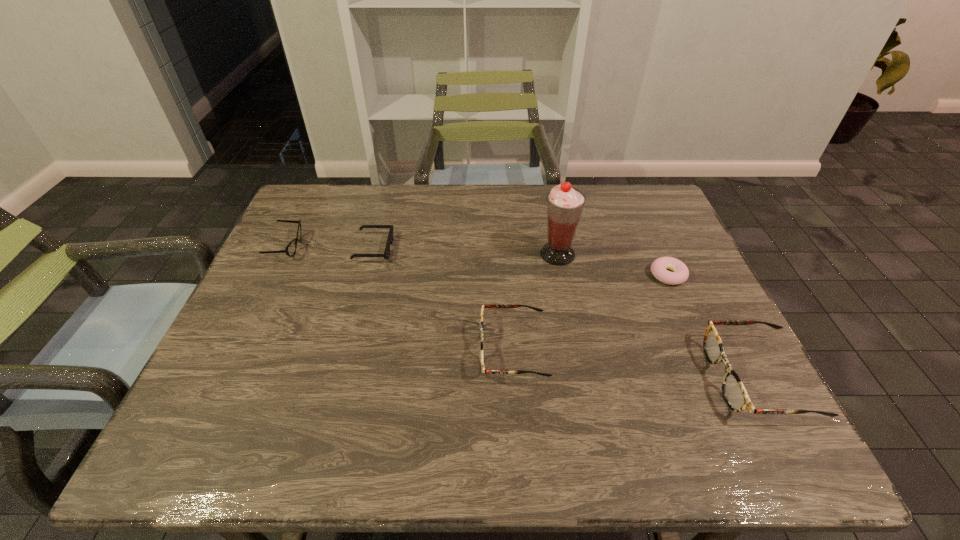
Where is `blank space located 0.070m on the frame of the second spectacles from right to left`? blank space located 0.070m on the frame of the second spectacles from right to left is located at coordinates (449, 349).

The height and width of the screenshot is (540, 960). I want to click on vacant space positioned on the frame of the second spectacles from right to left, so click(x=313, y=349).

Find the location of a particular element. The height and width of the screenshot is (540, 960). blank area located on the frame of the fifth shortest object is located at coordinates 529,379.

I want to click on free space located on the frame of the fifth shortest object, so click(649, 379).

Locate an element on the screen. This screenshot has height=540, width=960. free space located on the frame of the fifth shortest object is located at coordinates (654, 379).

Identify the location of free region located on the front-facing side of the shortest spectacles. The image size is (960, 540). (343, 247).

Image resolution: width=960 pixels, height=540 pixels. In order to click on free space located 0.380m on the front of the tallest object in this screenshot , I will do `click(583, 387)`.

You are a GUI agent. You are given a task and a screenshot of the screen. Output one action in this format:
    pyautogui.click(x=<x>, y=<y>)
    Task: Click on the vacant space located 0.320m on the front-facing side of the second object from left to right
    
    Given the screenshot: What is the action you would take?
    pyautogui.click(x=503, y=248)

You are a GUI agent. You are given a task and a screenshot of the screen. Output one action in this format:
    pyautogui.click(x=<x>, y=<y>)
    Task: Click on the vacant position located on the left of the doughnut
    
    Given the screenshot: What is the action you would take?
    pyautogui.click(x=594, y=275)

Image resolution: width=960 pixels, height=540 pixels. Find the location of `object positioned at the left edge`. object positioned at the left edge is located at coordinates (290, 250).